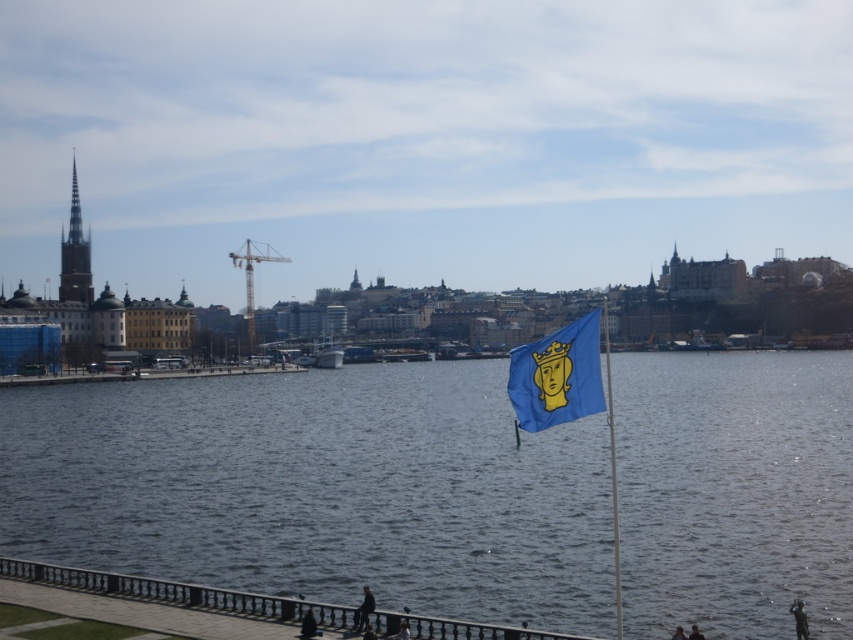
Question: Is blue water at center further to camera compared to blue fabric flag at center?

Choices:
 (A) yes
 (B) no

Answer: (A)

Question: Which of the following is the closest to the observer?

Choices:
 (A) blue water at center
 (B) yellow metallic mast at center

Answer: (A)

Question: Considering the real-world distances, which object is farthest from the blue water at center?

Choices:
 (A) yellow metallic mast at center
 (B) blue fabric flag at right
 (C) blue fabric flag at center

Answer: (A)

Question: Which object is the farthest from the yellow metallic mast at center?

Choices:
 (A) blue water at center
 (B) blue fabric flag at center

Answer: (B)

Question: Observing the image, what is the correct spatial positioning of blue water at center in reference to blue fabric flag at center?

Choices:
 (A) right
 (B) left

Answer: (B)

Question: Is blue water at center to the left of blue fabric flag at right from the viewer's perspective?

Choices:
 (A) yes
 (B) no

Answer: (A)